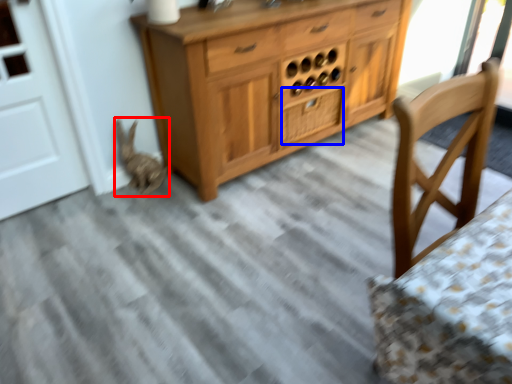
Question: Which object is closer to the camera taking this photo, animal (highlighted by a red box) or drawer (highlighted by a blue box)?

Choices:
 (A) animal
 (B) drawer

Answer: (A)